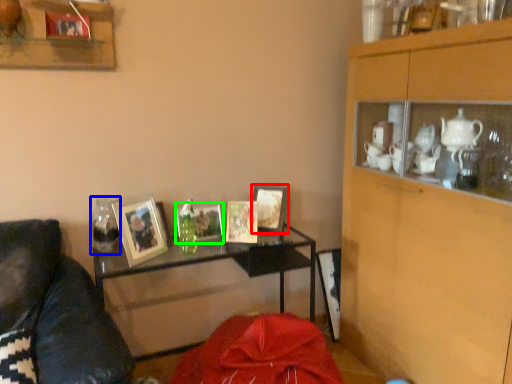
Question: Considering the real-world distances, which object is closest to picture frame (highlighted by a red box)? glass vase (highlighted by a blue box) or picture frame (highlighted by a green box).

Choices:
 (A) glass vase
 (B) picture frame

Answer: (B)